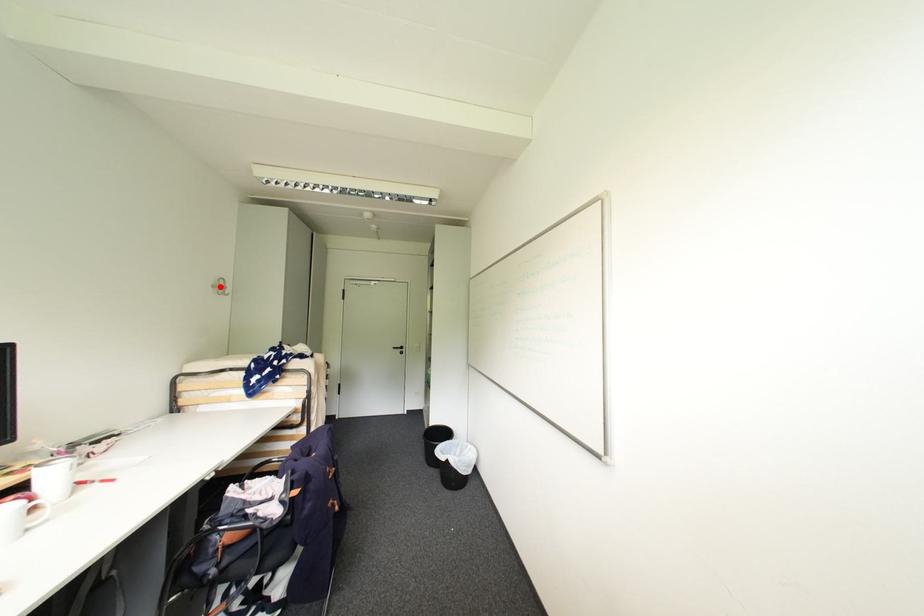
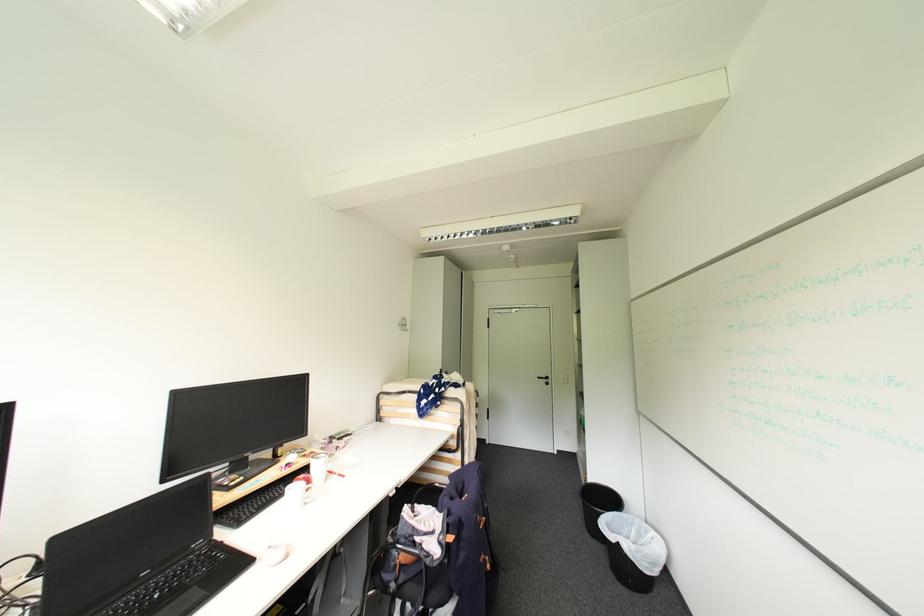
The point at the highlighted location is marked in the first image. Where is the corresponding point in the second image?

(406, 325)